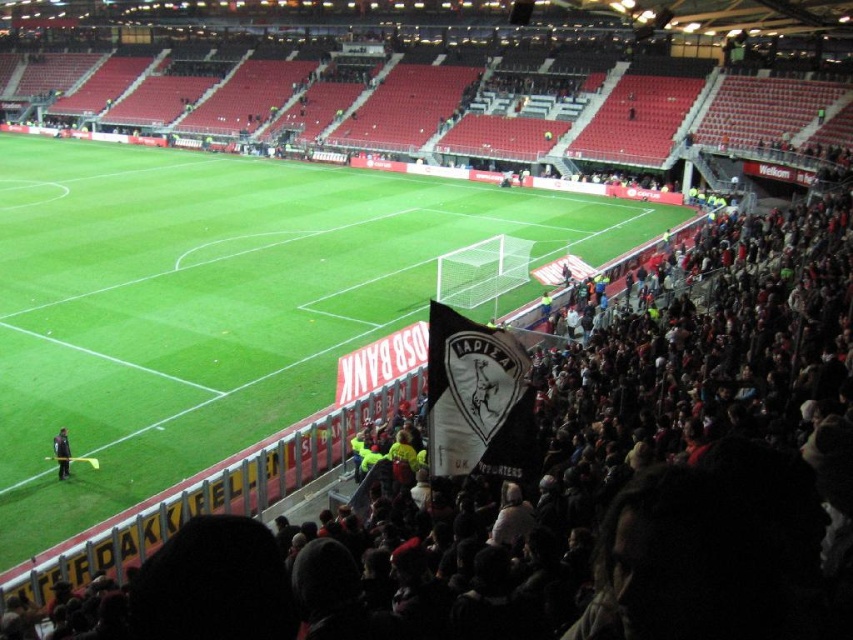
Question: Considering the relative positions of green grass at center and dark gray uniform at lower left in the image provided, where is green grass at center located with respect to dark gray uniform at lower left?

Choices:
 (A) right
 (B) left

Answer: (A)

Question: Does green grass at center have a larger size compared to dark gray uniform at lower left?

Choices:
 (A) no
 (B) yes

Answer: (B)

Question: Which point appears closest to the camera in this image?

Choices:
 (A) (67, 472)
 (B) (653, 236)

Answer: (A)

Question: Which point is farther from the camera taking this photo?

Choices:
 (A) (62, 452)
 (B) (155, 371)

Answer: (B)

Question: Does green grass at center have a lesser width compared to dark gray uniform at lower left?

Choices:
 (A) yes
 (B) no

Answer: (B)